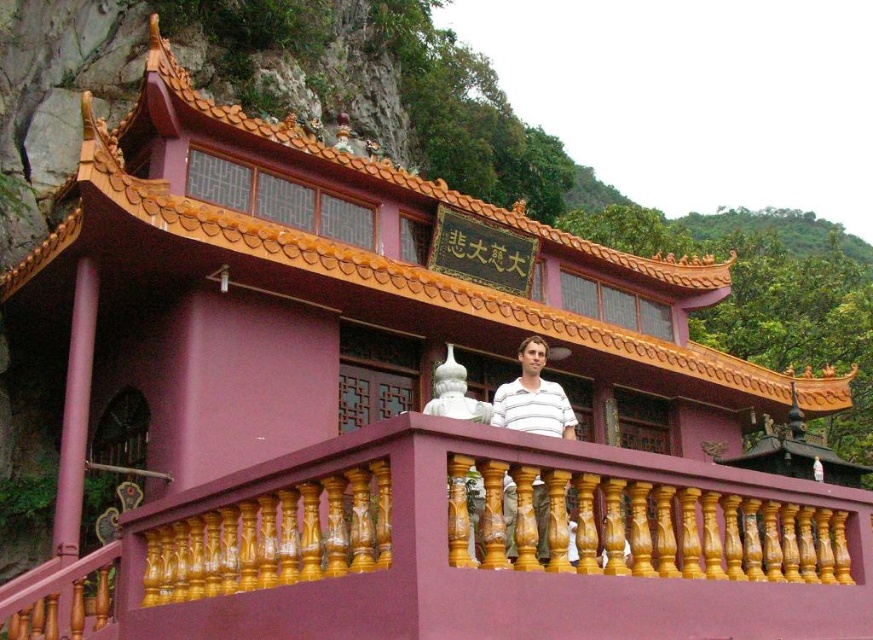
Question: Considering the relative positions of wooden at center and white striped shirt at center in the image provided, where is wooden at center located with respect to white striped shirt at center?

Choices:
 (A) left
 (B) right

Answer: (A)

Question: Is wooden at center closer to camera compared to white striped shirt at center?

Choices:
 (A) no
 (B) yes

Answer: (B)

Question: Which of the following is the closest to the observer?

Choices:
 (A) (512, 403)
 (B) (107, 561)

Answer: (B)

Question: Does wooden at center appear on the right side of white striped shirt at center?

Choices:
 (A) no
 (B) yes

Answer: (A)

Question: Which point appears closest to the camera in this image?

Choices:
 (A) (841, 547)
 (B) (506, 424)

Answer: (A)